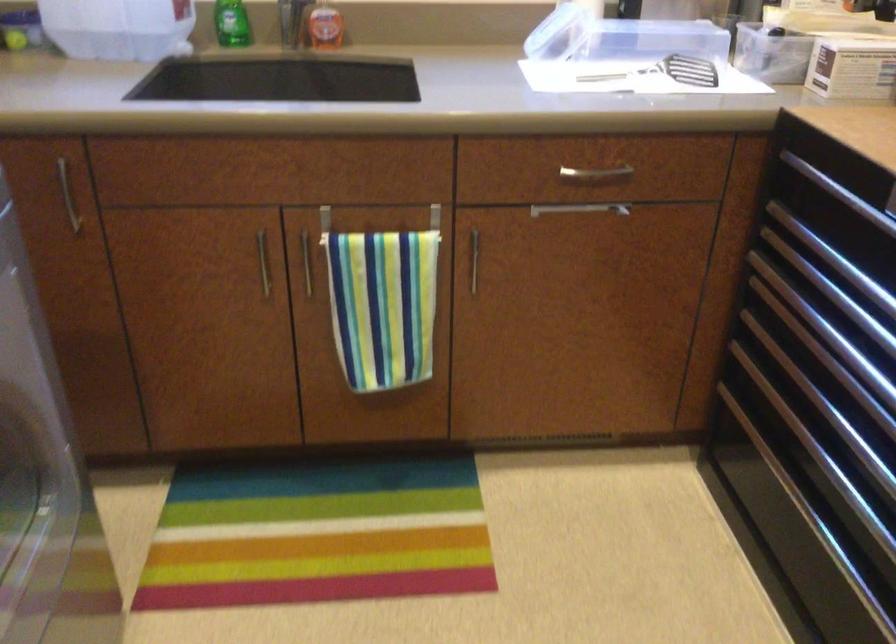
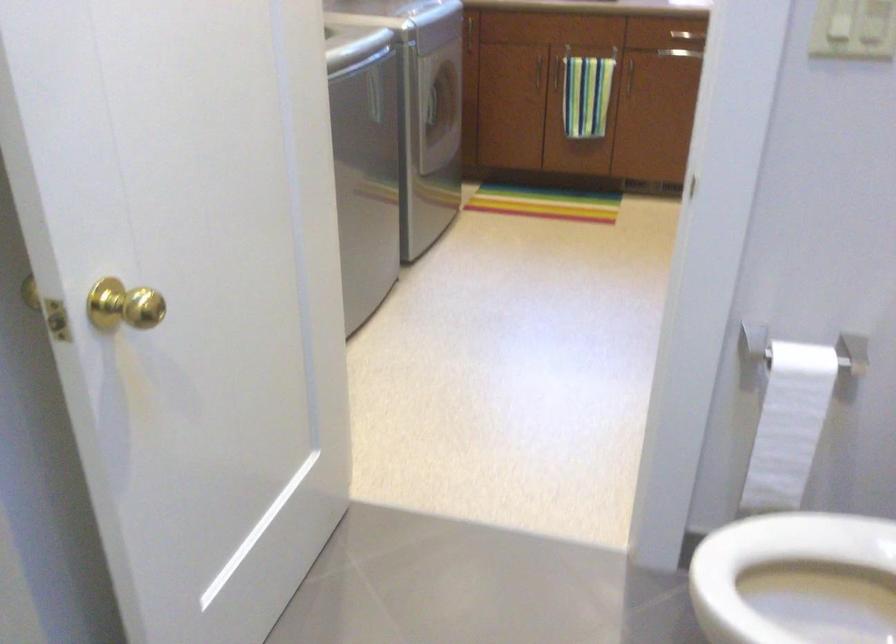
Question: In a continuous first-person perspective shot, in which direction is the camera moving?

Choices:
 (A) Left
 (B) Right
 (C) Forward
 (D) Backward

Answer: (D)